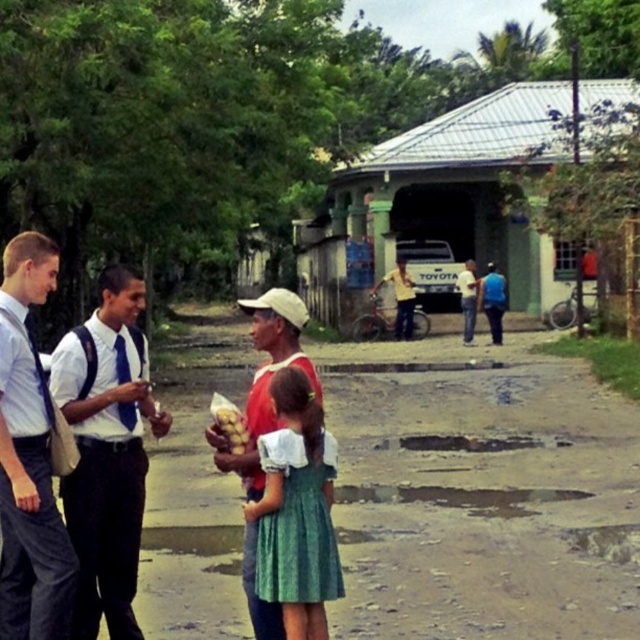
You are a photographer trying to frame a shot of the blue fabric shirt at center. If your camera has a focus point at coordinate 0.470, 0.770, will it align with the shirt?

Yes, the blue fabric shirt at center is located exactly at point (492,300), so the focus point will align perfectly with it.